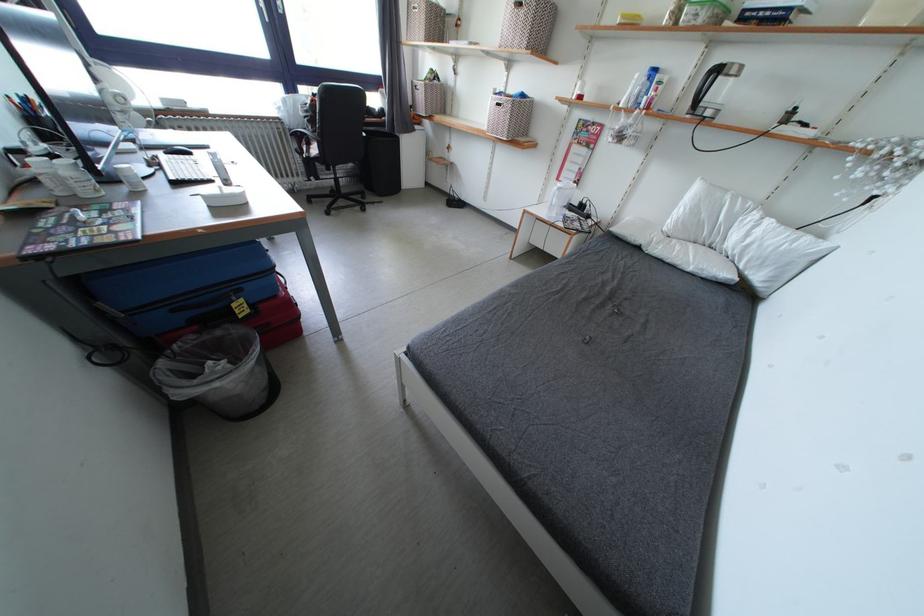
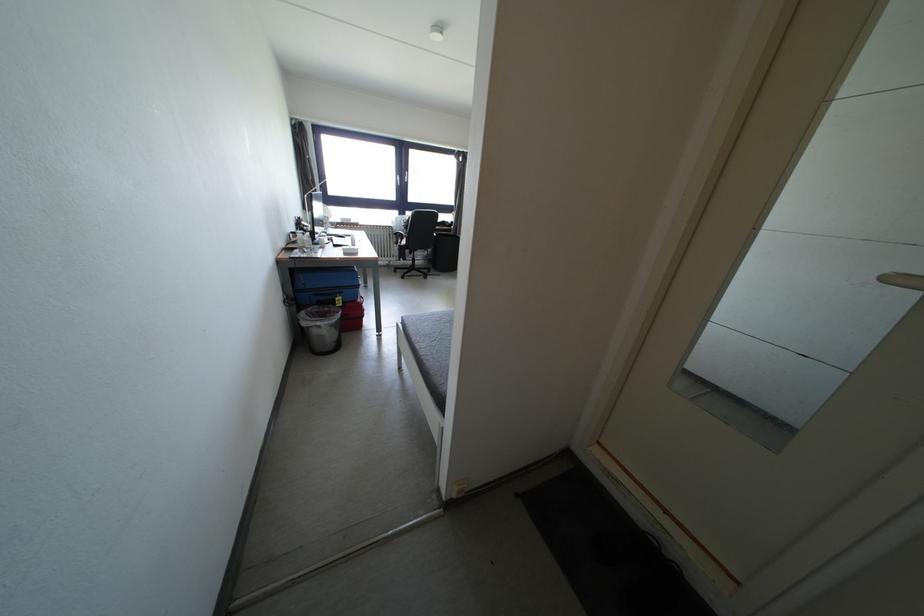
Locate, in the second image, the point that corresponds to pixel 237 292 in the first image.

(345, 294)